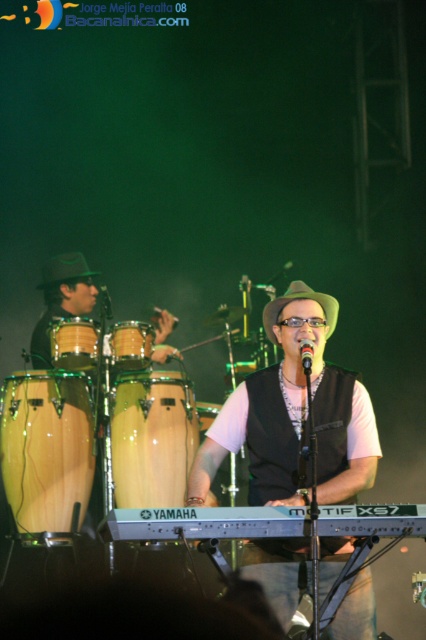
You are a stagehand setting up equipment. You need to position a new speaker to the left of the wooden drum at left. Where should you place it relative to the black matte microphone at center?

The black matte microphone at center is to the right of the wooden drum at left. Therefore, the speaker should be placed to the left of the wooden drum at left, which would be to the left of the black matte microphone at center.

You are standing in the audience and want to take a photo of the stage. There are two points on the stage marked as point (307,348) and point (106,291). Which point should you focus on to capture a clearer image since it is closer to you?

Point (307,348) is closer to the viewer, so focusing on that point will result in a clearer image.

From the picture: You are a stagehand adjusting the lighting for the performance. You need to ensure that the wooden conga drum at left and the green felt hat at left are both well lit. Given their sizes, which object requires a narrower spotlight to adequately illuminate it?

The wooden conga drum at left has a lesser width compared to the green felt hat at left, so it requires a narrower spotlight to adequately illuminate it.